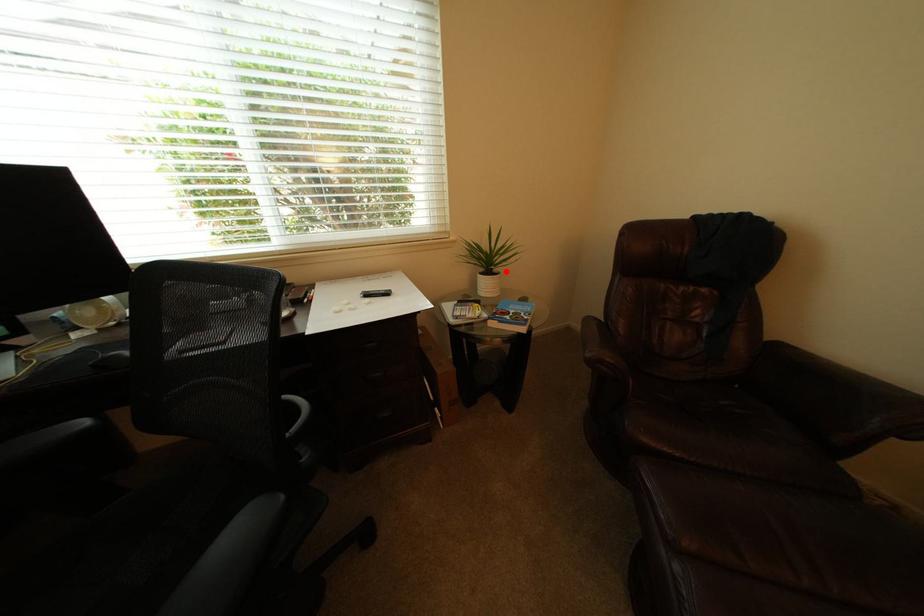
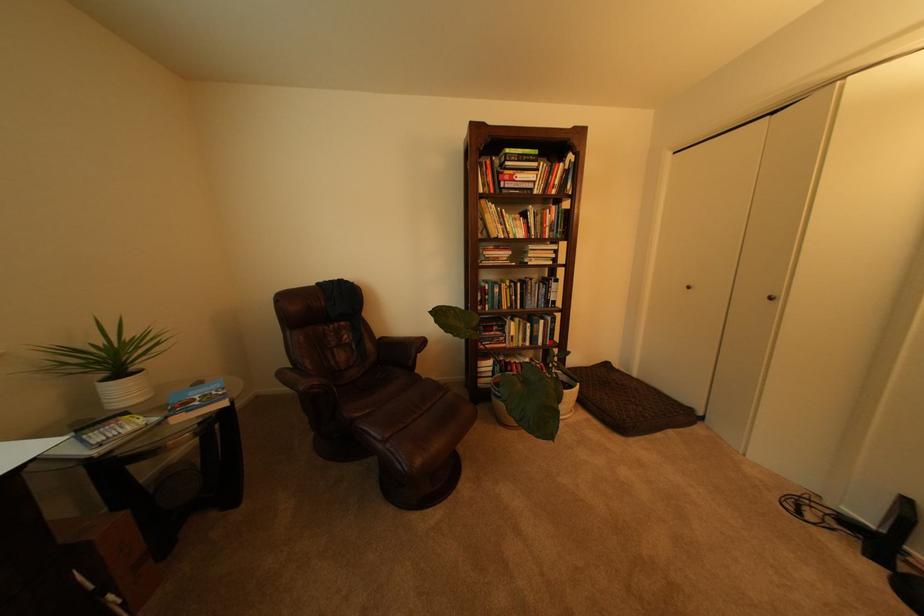
Question: I am providing you with two images of the same scene from different viewpoints. A red point is marked on the first image. Is the red point's position out of view in image 2?

Choices:
 (A) Yes
 (B) No

Answer: (B)